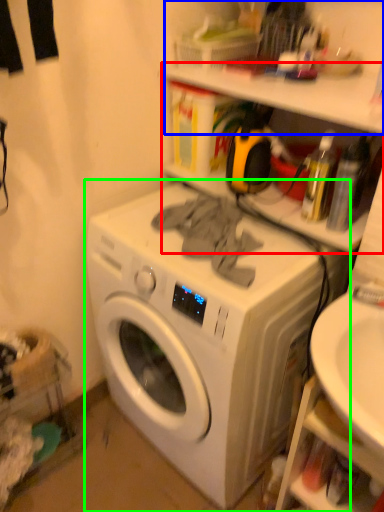
Question: Estimate the real-world distances between objects in this image. Which object is farther from shelf (highlighted by a red box), shelf (highlighted by a blue box) or washing machine (highlighted by a green box)?

Choices:
 (A) shelf
 (B) washing machine

Answer: (B)